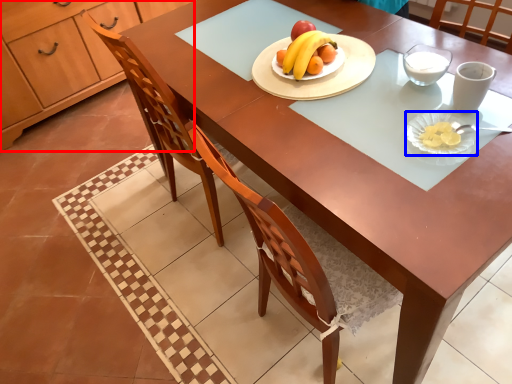
Question: Which object is further to the camera taking this photo, cabinetry (highlighted by a red box) or platter (highlighted by a blue box)?

Choices:
 (A) cabinetry
 (B) platter

Answer: (A)